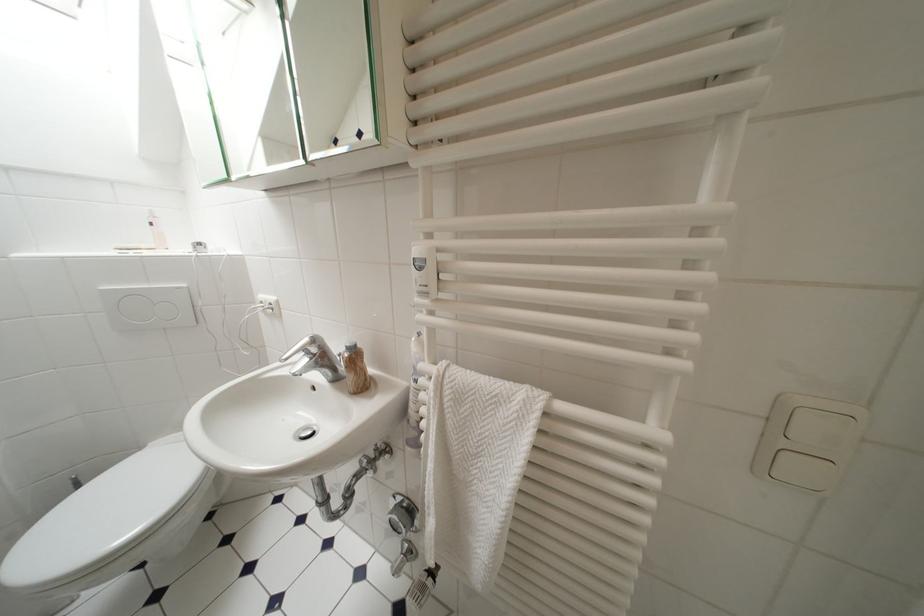
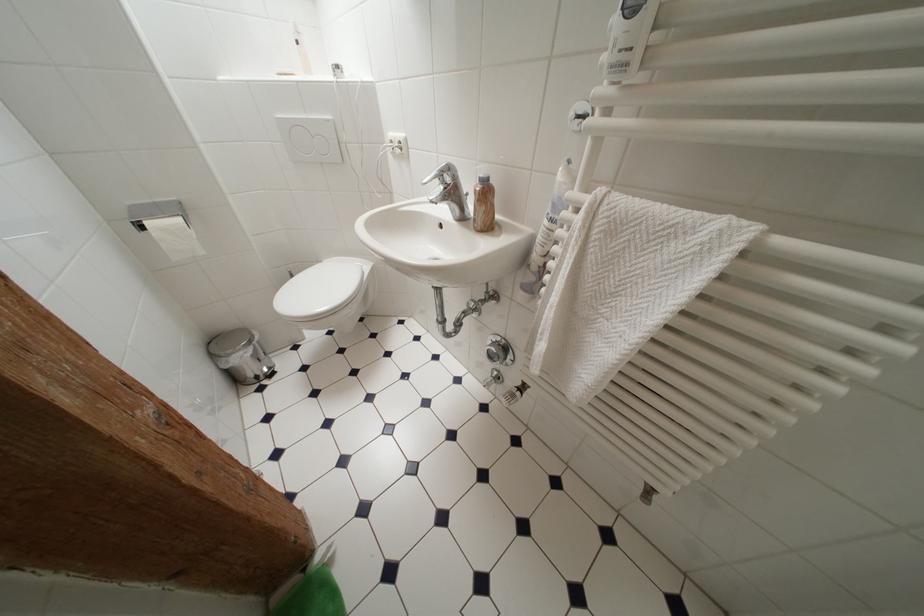
In the second image, find the point that corresponds to point 185,291 in the first image.

(333, 124)